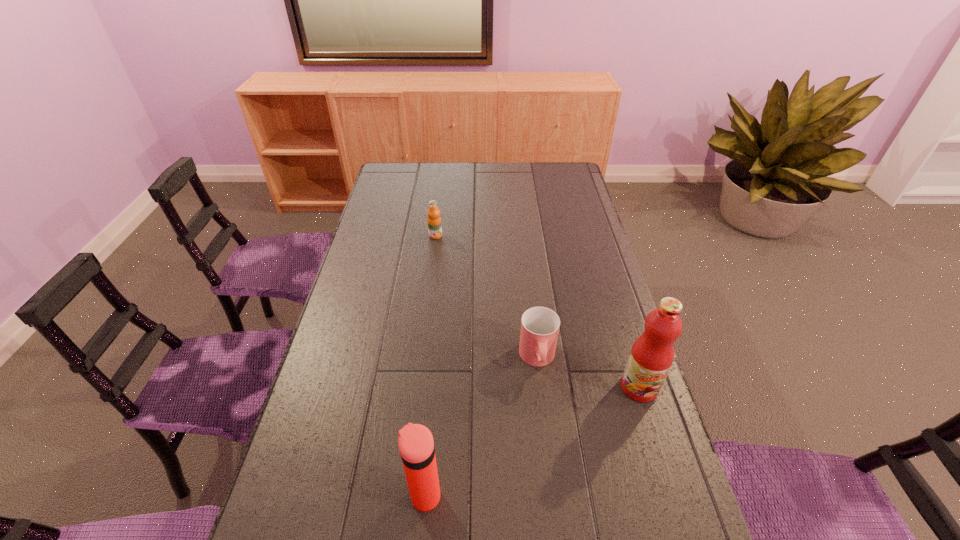
Find the location of a particular element. vacant space that is in between the tallest object and the second object from right to left is located at coordinates pos(588,373).

Where is `object identified as the third closest to the thermos bottle`? The height and width of the screenshot is (540, 960). object identified as the third closest to the thermos bottle is located at coordinates (434, 220).

Where is `object that can be found as the closest to the rightmost object`? This screenshot has width=960, height=540. object that can be found as the closest to the rightmost object is located at coordinates (540, 326).

What are the coordinates of `free space that satisfies the following two spatial constraints: 1. on the front side of the orange juice; 2. on the left side of the third shortest object` in the screenshot? It's located at (403, 496).

Find the location of a particular element. The image size is (960, 540). free space that satisfies the following two spatial constraints: 1. on the back side of the nearest object; 2. on the right side of the second object from right to left is located at coordinates point(438,359).